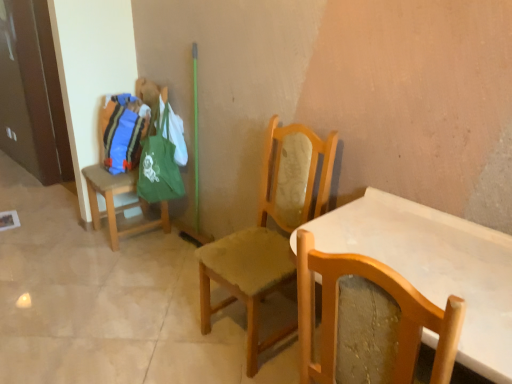
Locate an element on the screen. free space in front of wooden stool at left, the third chair when ordered from front to back is located at coordinates (113, 262).